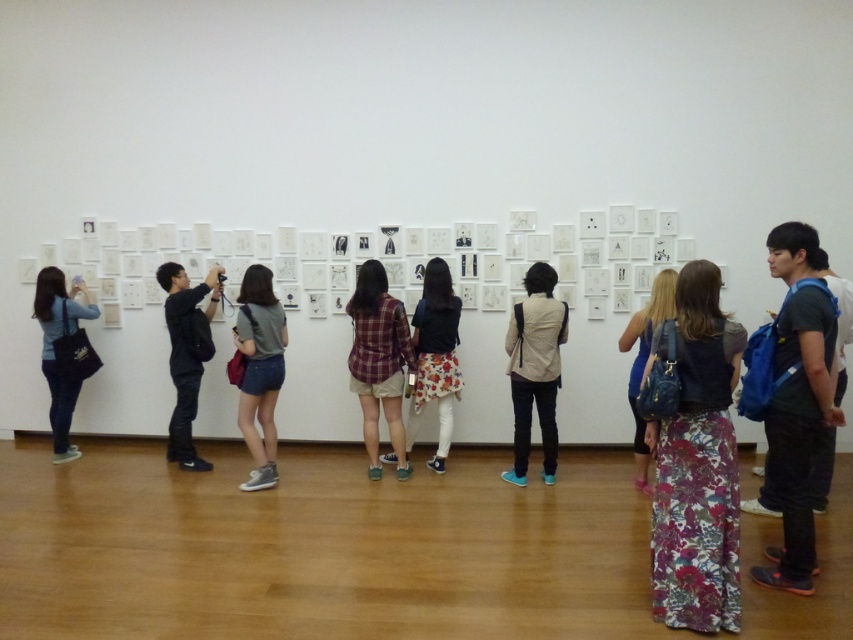
You are an art gallery attendant and need to guide a visitor to the exit, which is located behind the denim blue jeans at left. The visitor is currently standing near the floral fabric skirt at center. Which direction should the visitor move to reach the exit?

The visitor should move towards the left side since the denim blue jeans at left is closer to the exit compared to the floral fabric skirt at center, which is positioned further away from the exit.

You are an art enthusiast standing in the gallery and see the denim shorts at center and the floral dress at center. Which clothing item is closer to the ground?

The denim shorts at center is positioned under the floral dress at center, so the denim shorts at center is closer to the ground.

What is located at the point with coordinates (x=259, y=371) in the image?

The point at coordinates (x=259, y=371) corresponds to denim shorts at center.